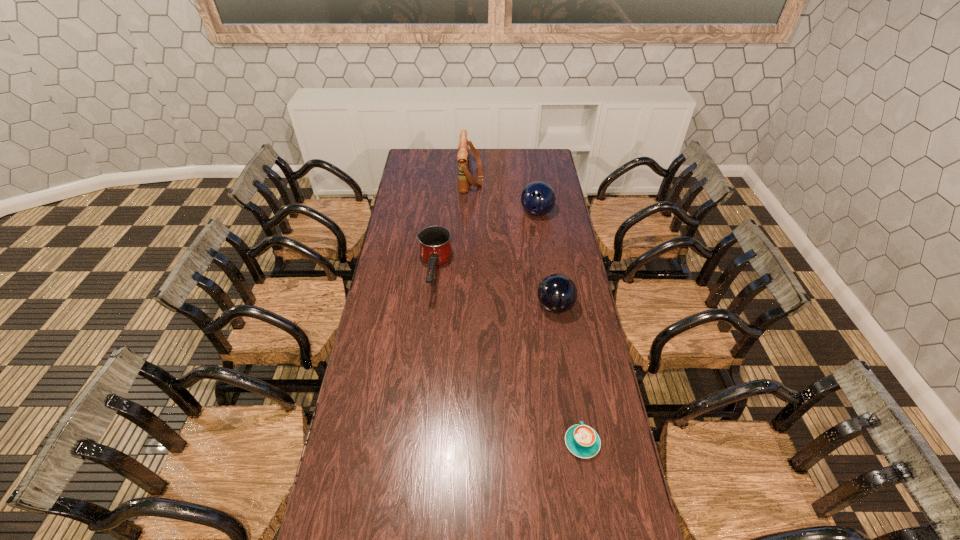
You are a GUI agent. You are given a task and a screenshot of the screen. Output one action in this format:
    pyautogui.click(x=<x>, y=<y>)
    Task: Click on the free region at the far right corner of the desktop
    The image size is (960, 540).
    Given the screenshot: What is the action you would take?
    pyautogui.click(x=546, y=161)

The height and width of the screenshot is (540, 960). Find the location of `free space between the saucepan and the second object from left to right`. free space between the saucepan and the second object from left to right is located at coordinates (452, 227).

This screenshot has width=960, height=540. What are the coordinates of `vacant space in between the farther bowling ball and the nearer bowling ball` in the screenshot? It's located at (545, 260).

Where is `free point between the nearer bowling ball and the fourth nearest object`? The width and height of the screenshot is (960, 540). free point between the nearer bowling ball and the fourth nearest object is located at coordinates 545,260.

Identify the location of free space that is in between the shortest object and the fourth object from right to left. (526, 310).

The image size is (960, 540). Find the location of `vacant space that's between the leftmost object and the nearest object`. vacant space that's between the leftmost object and the nearest object is located at coordinates (508, 359).

The height and width of the screenshot is (540, 960). Identify the location of free space between the farther bowling ball and the nearest object. coord(560,328).

Image resolution: width=960 pixels, height=540 pixels. Find the location of `free space between the nearer bowling ball and the cappuccino`. free space between the nearer bowling ball and the cappuccino is located at coordinates (568, 375).

Identify the location of free space between the shoulder bag and the nearer bowling ball. This screenshot has height=540, width=960. (513, 242).

Identify which object is the second closest to the nearer bowling ball. Please provide its 2D coordinates. Your answer should be formatted as a tuple, i.e. [(x, y)], where the tuple contains the x and y coordinates of a point satisfying the conditions above.

[(583, 441)]